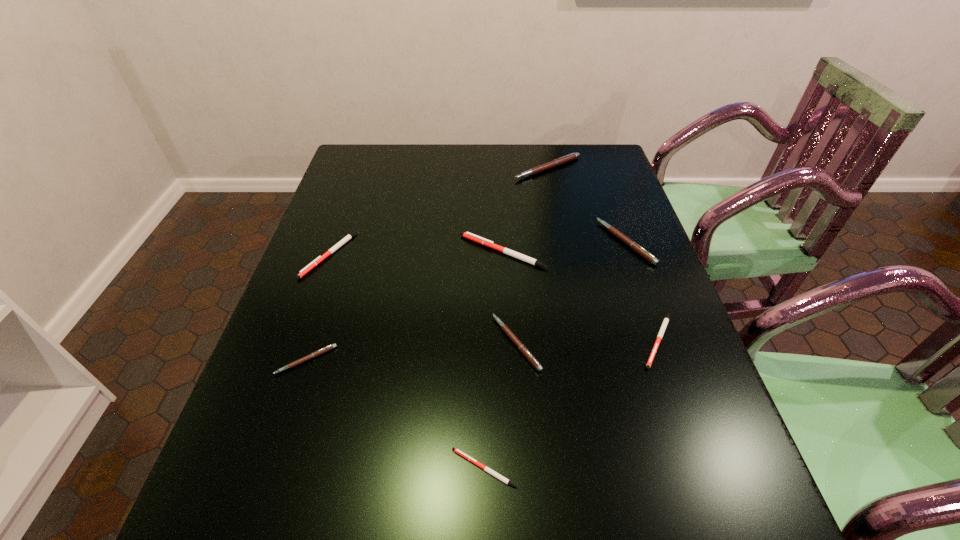
Identify the location of free space located 0.370m at the nib of the third biggest pink pen. This screenshot has width=960, height=540. (325, 343).

Where is `vacant space located on the clicker of the third smallest white pen`? This screenshot has height=540, width=960. vacant space located on the clicker of the third smallest white pen is located at coordinates (278, 394).

I want to click on blank space located at the nib of the smallest pink pen, so click(263, 492).

What are the coordinates of `vacant point located 0.060m on the clicker of the rightmost white pen` in the screenshot? It's located at (678, 396).

What are the coordinates of `vacant space located 0.060m on the clicker of the nearest object` in the screenshot? It's located at (418, 468).

Image resolution: width=960 pixels, height=540 pixels. I want to click on free space located on the clicker of the nearest object, so click(x=294, y=468).

At what (x,y) coordinates should I click in order to perform the action: click on blank space located 0.340m on the clicker of the nearest object. Please return your answer as a coordinate pair (x, y). Looking at the image, I should click on (259, 468).

Identify the location of object located in the far edge section of the desktop. The height and width of the screenshot is (540, 960). (572, 156).

This screenshot has height=540, width=960. Find the location of `object located in the far right corner section of the desktop`. object located in the far right corner section of the desktop is located at coordinates (572, 156).

In the image, there is a desktop. Where is `vacant space at the far edge`? This screenshot has width=960, height=540. vacant space at the far edge is located at coordinates (441, 171).